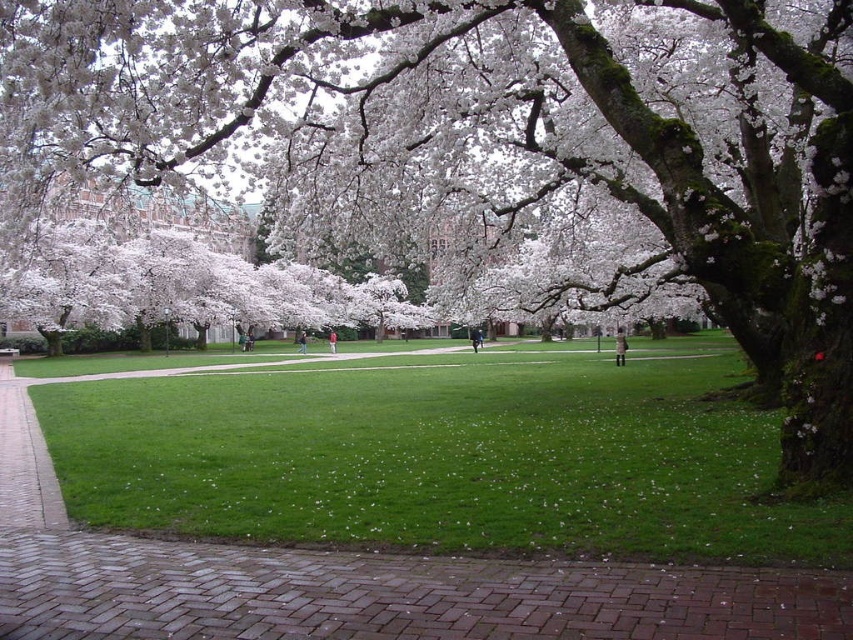
Is green grassy field at center above brick at lower center?

Indeed, green grassy field at center is positioned over brick at lower center.

What do you see at coordinates (445, 456) in the screenshot? I see `green grassy field at center` at bounding box center [445, 456].

Is point (728, 432) less distant than point (508, 634)?

No, it is not.

Locate an element on the screen. The width and height of the screenshot is (853, 640). green grassy field at center is located at coordinates (445, 456).